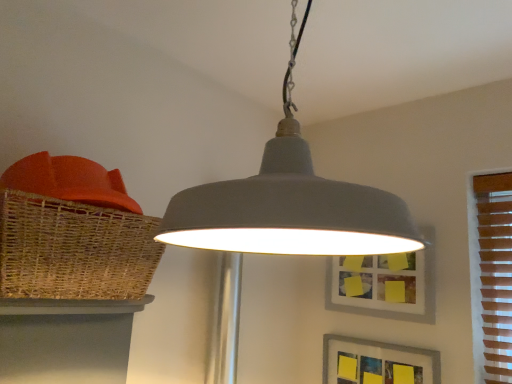
Question: Is matte gray pendant light at center bigger than matte gray picture frame at center, the second picture frame in the bottom-to-top sequence?

Choices:
 (A) no
 (B) yes

Answer: (B)

Question: Can you confirm if matte gray pendant light at center is smaller than matte gray picture frame at center, the second picture frame in the bottom-to-top sequence?

Choices:
 (A) no
 (B) yes

Answer: (A)

Question: Is matte gray pendant light at center positioned behind matte gray picture frame at center, the second picture frame in the bottom-to-top sequence?

Choices:
 (A) yes
 (B) no

Answer: (B)

Question: Does matte gray pendant light at center have a greater width compared to matte gray picture frame at center, the second picture frame in the bottom-to-top sequence?

Choices:
 (A) yes
 (B) no

Answer: (A)

Question: Is matte gray pendant light at center aimed at matte gray picture frame at center, the second picture frame in the bottom-to-top sequence?

Choices:
 (A) no
 (B) yes

Answer: (A)

Question: Considering their positions, is woven brown basket at left located in front of or behind matte gray pendant light at center?

Choices:
 (A) behind
 (B) front

Answer: (A)

Question: Looking at the image, does woven brown basket at left seem bigger or smaller compared to matte gray pendant light at center?

Choices:
 (A) big
 (B) small

Answer: (B)

Question: Is woven brown basket at left wider or thinner than matte gray pendant light at center?

Choices:
 (A) wide
 (B) thin

Answer: (B)

Question: Is woven brown basket at left taller or shorter than matte gray pendant light at center?

Choices:
 (A) tall
 (B) short

Answer: (B)

Question: Visually, is matte gray pendant light at center positioned to the left or to the right of matte wicker table at lower left?

Choices:
 (A) right
 (B) left

Answer: (A)

Question: Relative to matte wicker table at lower left, is matte gray pendant light at center in front or behind?

Choices:
 (A) front
 (B) behind

Answer: (A)

Question: In terms of width, does matte gray pendant light at center look wider or thinner when compared to matte wicker table at lower left?

Choices:
 (A) thin
 (B) wide

Answer: (B)

Question: Is matte gray pendant light at center bigger or smaller than matte wicker table at lower left?

Choices:
 (A) big
 (B) small

Answer: (A)

Question: Would you say matte gray pendant light at center is to the left or to the right of matte gray picture frame at center, the second picture frame in the bottom-to-top sequence, in the picture?

Choices:
 (A) left
 (B) right

Answer: (A)

Question: Is matte gray pendant light at center wider or thinner than matte gray picture frame at center, the 1th picture frame from the top?

Choices:
 (A) thin
 (B) wide

Answer: (B)